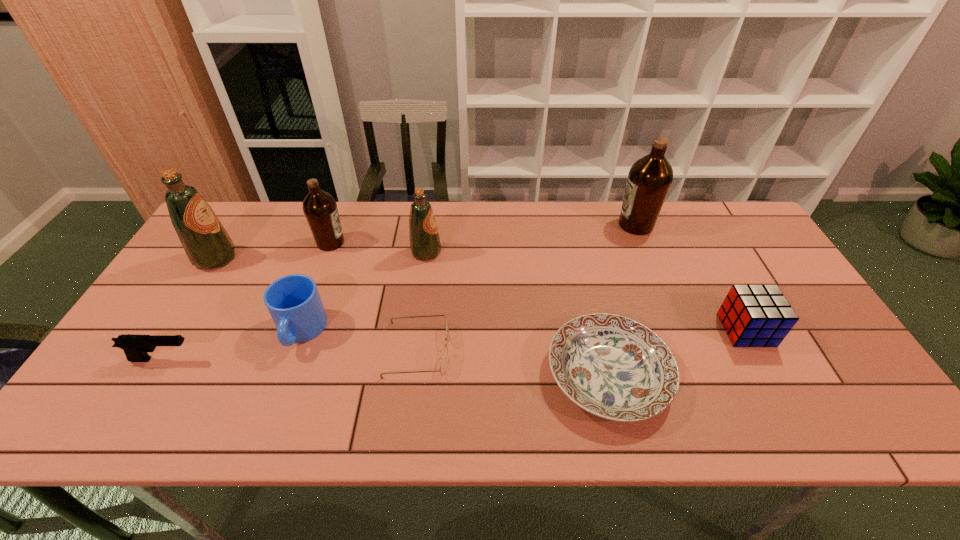
Image resolution: width=960 pixels, height=540 pixels. In order to click on red cube in this screenshot , I will do `click(752, 315)`.

Where is `pistol`? This screenshot has height=540, width=960. pistol is located at coordinates (135, 347).

At what (x,y) coordinates should I click in order to perform the action: click on the seventh tallest object. Please return your answer as a coordinate pair (x, y). Looking at the image, I should click on (135, 347).

You are a GUI agent. You are given a task and a screenshot of the screen. Output one action in this format:
    pyautogui.click(x=<x>, y=<y>)
    Task: Click on the beige spectacles
    
    Given the screenshot: What is the action you would take?
    (x=444, y=361)

At what (x,y) coordinates should I click in order to perform the action: click on plate. Please return your answer as a coordinate pair (x, y). Looking at the image, I should click on (614, 367).

This screenshot has width=960, height=540. In order to click on free space located on the front-facing side of the leftmost olive oil in this screenshot , I will do `click(253, 258)`.

In order to click on free space located on the label of the rightmost olive oil in this screenshot , I will do `click(588, 225)`.

The width and height of the screenshot is (960, 540). I want to click on vacant region located 0.330m on the label of the rightmost olive oil, so click(516, 225).

I want to click on free spot located 0.130m on the label of the rightmost olive oil, so click(577, 225).

Where is `free space located 0.130m on the front-facing side of the third olive oil from left to right`? free space located 0.130m on the front-facing side of the third olive oil from left to right is located at coordinates (484, 252).